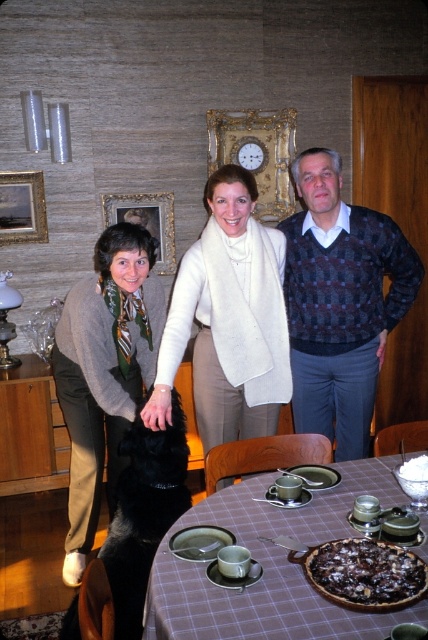
Can you confirm if matte beige sweater at center is smaller than white frosted cake at table center?

Actually, matte beige sweater at center might be larger than white frosted cake at table center.

Can you confirm if matte beige sweater at center is positioned to the right of white frosted cake at table center?

In fact, matte beige sweater at center is to the left of white frosted cake at table center.

Where is `matte beige sweater at center`? The image size is (428, 640). matte beige sweater at center is located at coordinates (338, 387).

Identify the location of matte beige sweater at center. This screenshot has height=640, width=428. (338, 387).

Who is positioned more to the left, plaid fabric table at center or chocolate cake at center?

plaid fabric table at center

The image size is (428, 640). Describe the element at coordinates (270, 566) in the screenshot. I see `plaid fabric table at center` at that location.

Who is more distant from viewer, (219, 621) or (386, 576)?

The point (386, 576) is more distant.

Where is `plaid fabric table at center`? The width and height of the screenshot is (428, 640). plaid fabric table at center is located at coordinates (270, 566).

Who is more forward, (335, 288) or (131, 236)?

Point (131, 236) is in front.

Between point (418, 268) and point (122, 396), which one is positioned behind?

The point (418, 268) is more distant.

Identify the location of plaid sweater at center. The width and height of the screenshot is (428, 640). point(341,301).